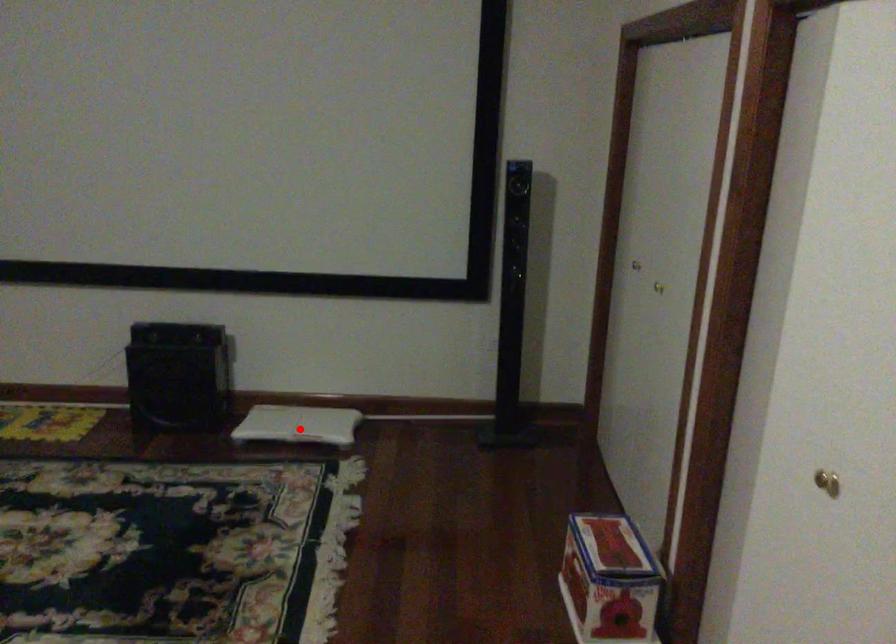
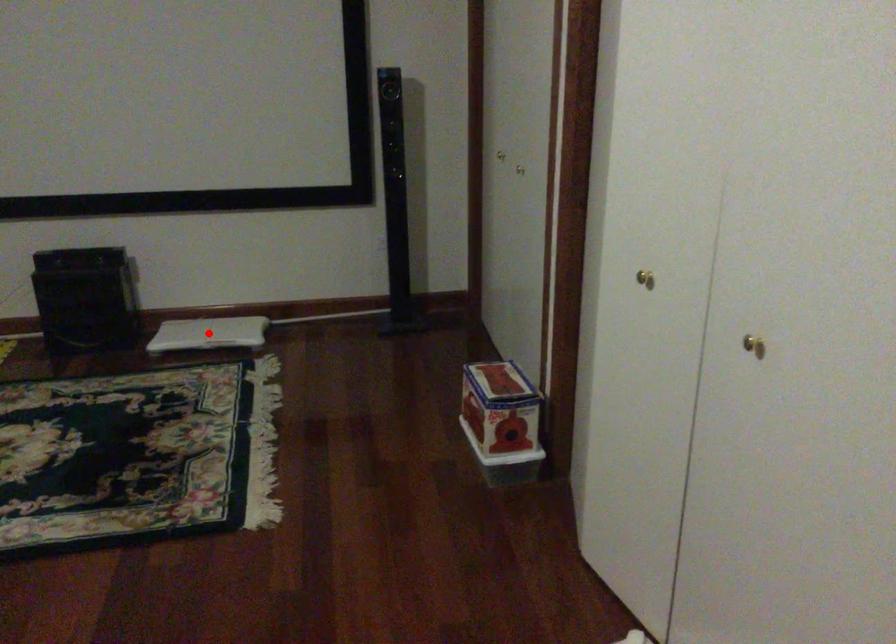
I am providing you with two images of the same scene from different viewpoints. A red point is marked on the first image and another point is marked on the second image. Does the point marked in image1 correspond to the same location as the one in image2?

Yes